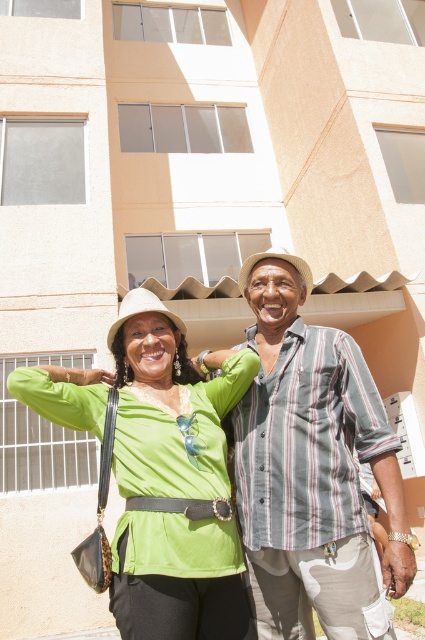
Question: Among these objects, which one is farthest from the camera?

Choices:
 (A) green matte shirt at center
 (B) striped cotton shirt at center

Answer: (B)

Question: Which object is closer to the camera taking this photo?

Choices:
 (A) green matte shirt at center
 (B) striped cotton shirt at center

Answer: (A)

Question: Is striped cotton shirt at center in front of green matte shirt at center?

Choices:
 (A) no
 (B) yes

Answer: (A)

Question: Can you confirm if striped cotton shirt at center is bigger than green matte shirt at center?

Choices:
 (A) no
 (B) yes

Answer: (A)

Question: Is striped cotton shirt at center positioned behind green matte shirt at center?

Choices:
 (A) no
 (B) yes

Answer: (B)